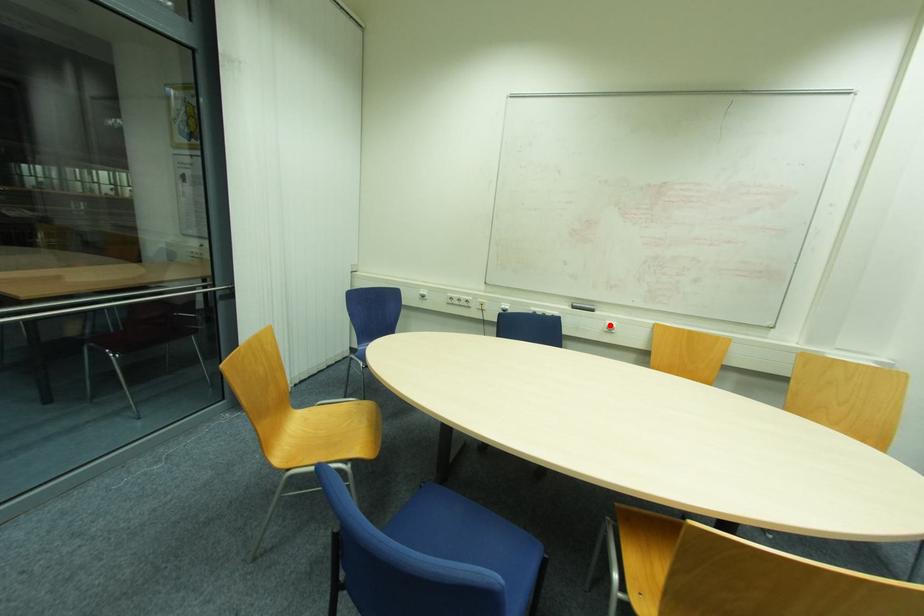
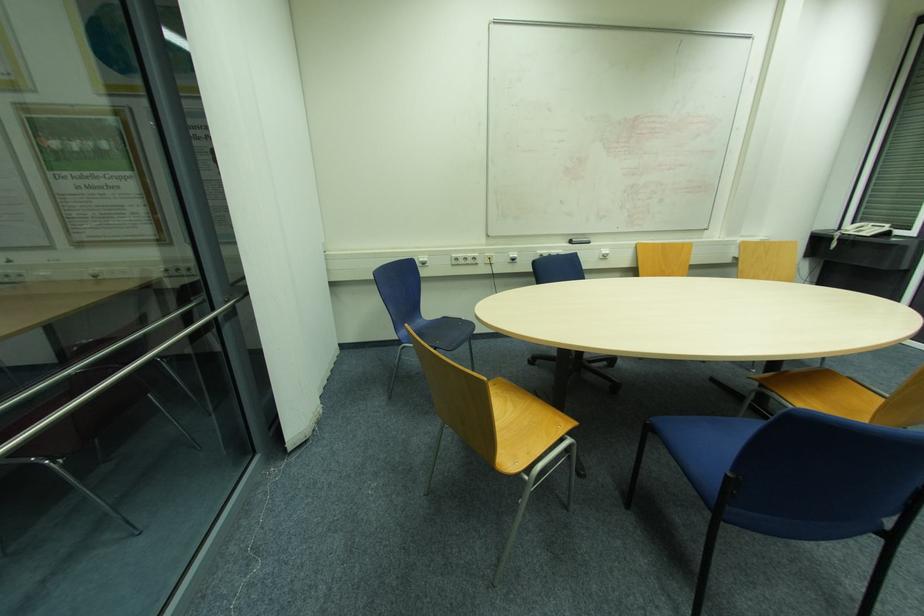
Question: I am providing you with two images of the same scene from different viewpoints. A red point is shown in image1. For the corresponding object point in image2, is it positioned nearer or farther from the camera?

Choices:
 (A) Nearer
 (B) Farther

Answer: (A)